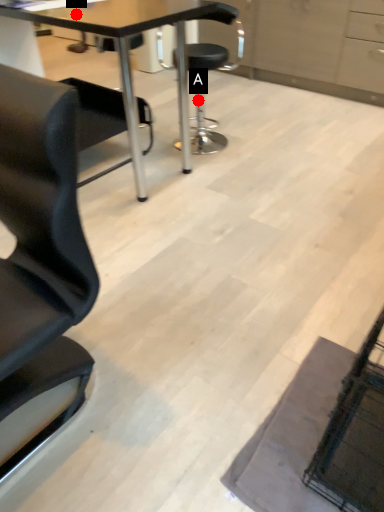
Question: Two points are circled on the image, labeled by A and B beside each circle. Which point appears closest to the camera in this image?

Choices:
 (A) A is closer
 (B) B is closer

Answer: (B)